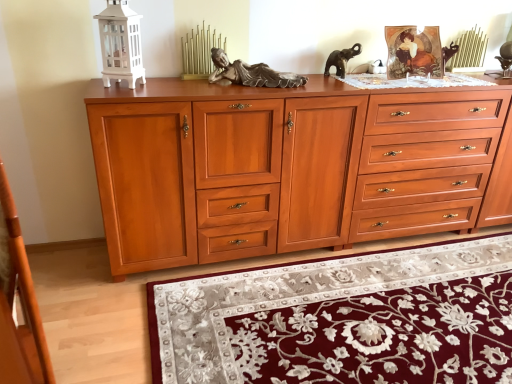
You are a GUI agent. You are given a task and a screenshot of the screen. Output one action in this format:
    pyautogui.click(x=<x>, y=<y>)
    Task: Click on the free space in front of cherry wood chest of drawers at center
    
    Given the screenshot: What is the action you would take?
    pyautogui.click(x=366, y=304)